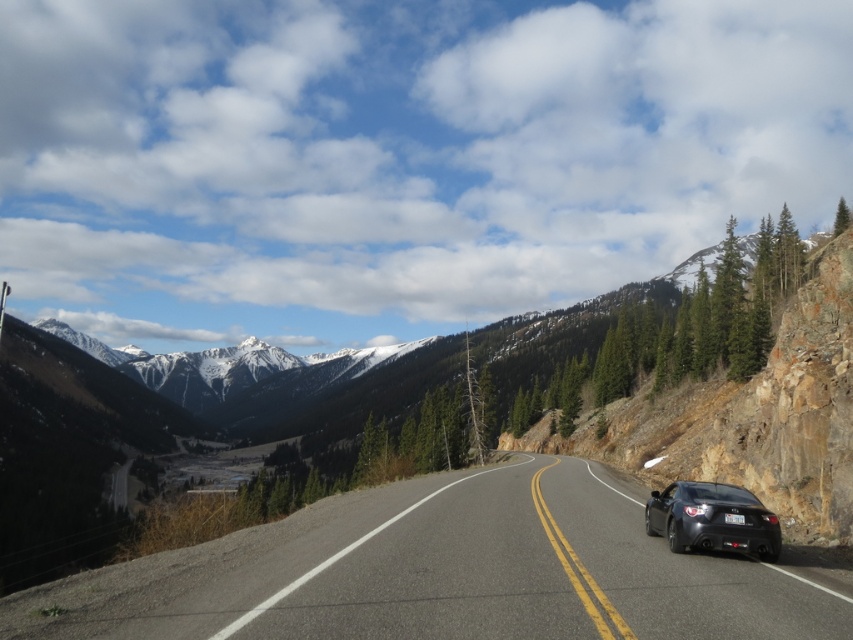
Question: Among these points, which one is nearest to the camera?

Choices:
 (A) (111, 570)
 (B) (758, 506)

Answer: (A)

Question: Considering the relative positions of black asphalt road at center and glossy black car at center in the image provided, where is black asphalt road at center located with respect to glossy black car at center?

Choices:
 (A) below
 (B) above

Answer: (A)

Question: Does black asphalt road at center appear over glossy black car at center?

Choices:
 (A) no
 (B) yes

Answer: (A)

Question: Which of the following is the closest to the observer?

Choices:
 (A) (593, 600)
 (B) (728, 518)

Answer: (A)

Question: Observing the image, what is the correct spatial positioning of black asphalt road at center in reference to glossy black car at center?

Choices:
 (A) left
 (B) right

Answer: (A)